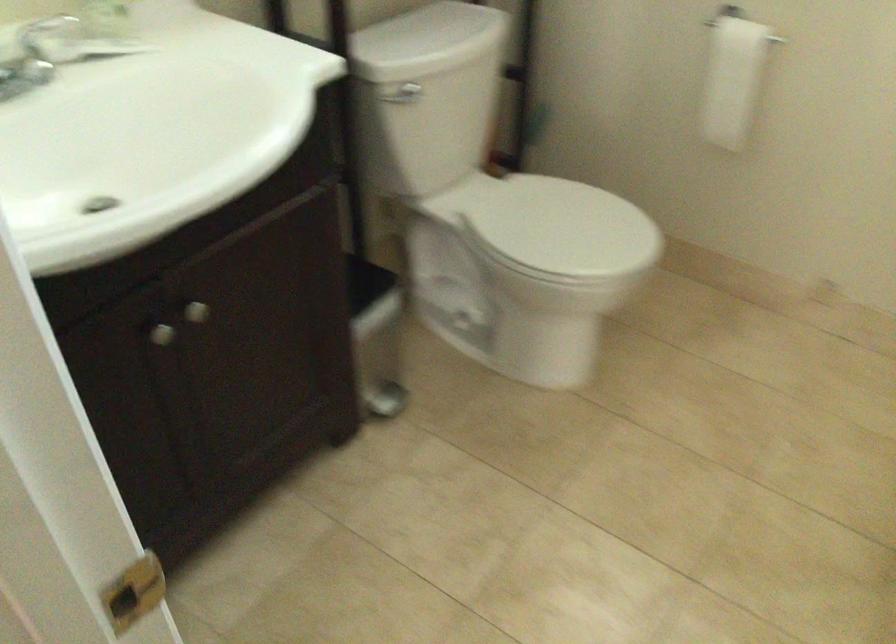
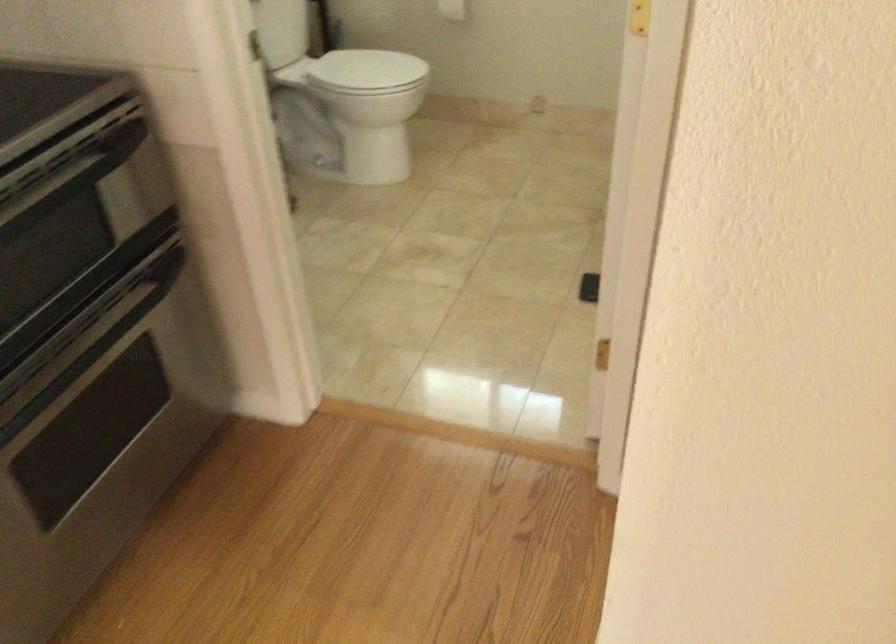
Question: The images are taken continuously from a first-person perspective. In which direction are you moving?

Choices:
 (A) Left
 (B) Right
 (C) Forward
 (D) Backward

Answer: (D)